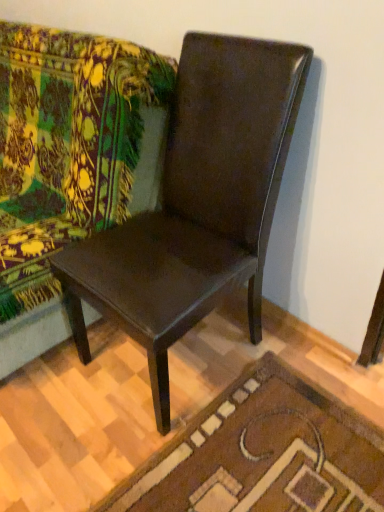
Question: Is glossy brown chair at center far from brown textured rug at lower center?

Choices:
 (A) yes
 (B) no

Answer: (B)

Question: Is glossy brown chair at center facing away from brown textured rug at lower center?

Choices:
 (A) yes
 (B) no

Answer: (B)

Question: Is the depth of glossy brown chair at center less than that of brown textured rug at lower center?

Choices:
 (A) no
 (B) yes

Answer: (B)

Question: Does glossy brown chair at center have a lesser height compared to brown textured rug at lower center?

Choices:
 (A) no
 (B) yes

Answer: (A)

Question: Considering the relative sizes of glossy brown chair at center and brown textured rug at lower center in the image provided, is glossy brown chair at center thinner than brown textured rug at lower center?

Choices:
 (A) yes
 (B) no

Answer: (A)

Question: From the image's perspective, is glossy brown chair at center located above or below green floral fabric couch at upper left?

Choices:
 (A) below
 (B) above

Answer: (A)

Question: In the image, is glossy brown chair at center on the left side or the right side of green floral fabric couch at upper left?

Choices:
 (A) right
 (B) left

Answer: (A)

Question: Is point 142,242 positioned closer to the camera than point 77,228?

Choices:
 (A) closer
 (B) farther

Answer: (A)

Question: Do you think glossy brown chair at center is within green floral fabric couch at upper left, or outside of it?

Choices:
 (A) inside
 (B) outside

Answer: (B)

Question: In the image, is glossy brown chair at center positioned in front of or behind brown textured rug at lower center?

Choices:
 (A) behind
 (B) front

Answer: (B)

Question: Considering the positions of glossy brown chair at center and brown textured rug at lower center in the image, is glossy brown chair at center taller or shorter than brown textured rug at lower center?

Choices:
 (A) short
 (B) tall

Answer: (B)

Question: Which is correct: glossy brown chair at center is inside brown textured rug at lower center, or outside of it?

Choices:
 (A) inside
 (B) outside

Answer: (B)

Question: Is point (256, 61) positioned closer to the camera than point (236, 479)?

Choices:
 (A) closer
 (B) farther

Answer: (A)

Question: From their relative heights in the image, would you say brown textured rug at lower center is taller or shorter than green floral fabric couch at upper left?

Choices:
 (A) tall
 (B) short

Answer: (B)

Question: In terms of width, does brown textured rug at lower center look wider or thinner when compared to green floral fabric couch at upper left?

Choices:
 (A) thin
 (B) wide

Answer: (A)